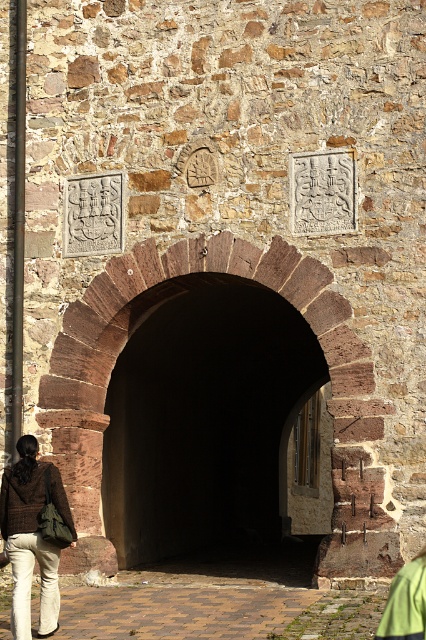
Is dark stone tunnel at center wider than khaki cotton pants at lower left?

Indeed, dark stone tunnel at center has a greater width compared to khaki cotton pants at lower left.

In the scene shown: Between dark stone tunnel at center and khaki cotton pants at lower left, which one appears on the left side from the viewer's perspective?

From the viewer's perspective, khaki cotton pants at lower left appears more on the left side.

Which is behind, point (138, 554) or point (8, 538)?

Positioned behind is point (138, 554).

The height and width of the screenshot is (640, 426). Identify the location of dark stone tunnel at center. (203, 420).

What do you see at coordinates (178, 611) in the screenshot? Image resolution: width=426 pixels, height=640 pixels. I see `brick pavement at lower center` at bounding box center [178, 611].

Which is more to the right, brick pavement at lower center or khaki cotton pants at lower left?

Positioned to the right is brick pavement at lower center.

Describe the element at coordinates (178, 611) in the screenshot. I see `brick pavement at lower center` at that location.

I want to click on brick pavement at lower center, so click(178, 611).

Is point (121, 476) behind point (239, 604)?

Yes, it is behind point (239, 604).

Between point (167, 317) and point (270, 618), which one is positioned in front?

Point (270, 618) is more forward.

Where is `dark stone tunnel at center`? The height and width of the screenshot is (640, 426). dark stone tunnel at center is located at coordinates (203, 420).